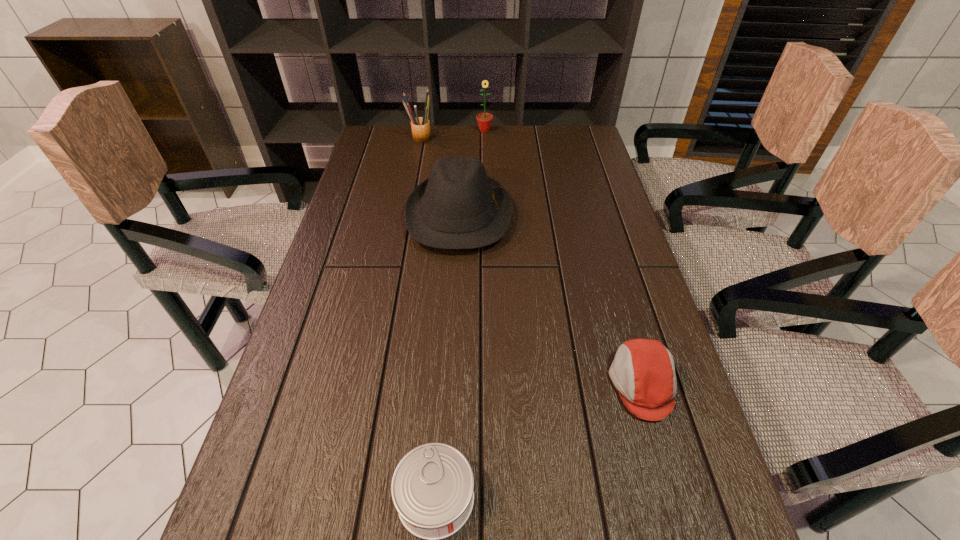
You are a GUI agent. You are given a task and a screenshot of the screen. Output one action in this format:
    pyautogui.click(x=<x>, y=<y>)
    Task: Click on the sunflower
    
    Given the screenshot: What is the action you would take?
    pyautogui.click(x=484, y=120)

Where is `pencil box`? pencil box is located at coordinates (420, 126).

Where is `the third farthest object`? This screenshot has height=540, width=960. the third farthest object is located at coordinates (458, 207).

Image resolution: width=960 pixels, height=540 pixels. Find the location of `the second nearest object`. the second nearest object is located at coordinates (643, 371).

At what (x,y) coordinates should I click in order to perform the action: click on the rightmost object. Please return your answer as a coordinate pair (x, y). The width and height of the screenshot is (960, 540). Looking at the image, I should click on (643, 371).

The width and height of the screenshot is (960, 540). I want to click on vacant space situated 0.300m on the face of the sunflower, so click(486, 180).

The height and width of the screenshot is (540, 960). In order to click on blank space located on the right of the pencil box in this screenshot , I will do `click(523, 138)`.

Locate an element on the screen. Image resolution: width=960 pixels, height=540 pixels. vacant space located 0.060m on the front-facing side of the fedora is located at coordinates (533, 216).

The width and height of the screenshot is (960, 540). I want to click on vacant space located on the front-facing side of the rightmost object, so click(449, 384).

Find the location of a particular element. free region located 0.310m on the front-facing side of the rightmost object is located at coordinates (459, 384).